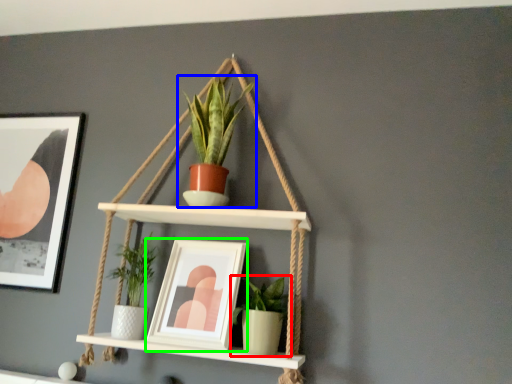
Question: Estimate the real-world distances between objects in this image. Which object is closer to houseplant (highlighted by a red box), houseplant (highlighted by a blue box) or picture frame (highlighted by a green box)?

Choices:
 (A) houseplant
 (B) picture frame

Answer: (B)